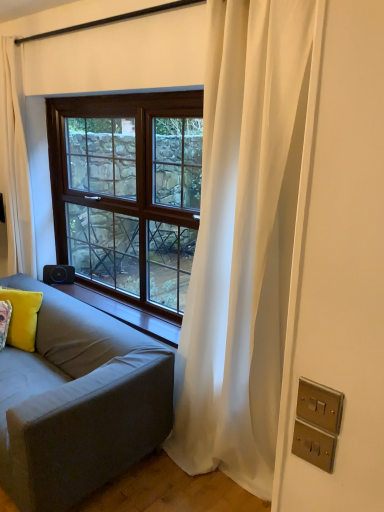
Question: Is white sheer curtain at right, the 2th curtain when ordered from left to right, wider than black plastic speaker at lower left?

Choices:
 (A) no
 (B) yes

Answer: (B)

Question: From the image's perspective, is white sheer curtain at right, the 2th curtain when ordered from left to right, below black plastic speaker at lower left?

Choices:
 (A) yes
 (B) no

Answer: (B)

Question: Can you confirm if white sheer curtain at right, the 2th curtain when ordered from left to right, is shorter than black plastic speaker at lower left?

Choices:
 (A) no
 (B) yes

Answer: (A)

Question: From a real-world perspective, does white sheer curtain at right, positioned as the 1th curtain in front-to-back order, stand above black plastic speaker at lower left?

Choices:
 (A) yes
 (B) no

Answer: (A)

Question: Can you confirm if white sheer curtain at right, which is the 1th curtain from right to left, is positioned to the left of black plastic speaker at lower left?

Choices:
 (A) no
 (B) yes

Answer: (A)

Question: From the image's perspective, is black plastic speaker at lower left positioned above or below white sheer curtain at right, the 2th curtain when ordered from left to right?

Choices:
 (A) above
 (B) below

Answer: (B)

Question: Choose the correct answer: Is black plastic speaker at lower left inside white sheer curtain at right, which appears as the 2th curtain when viewed from the back, or outside it?

Choices:
 (A) inside
 (B) outside

Answer: (B)

Question: In the image, is black plastic speaker at lower left positioned in front of or behind white sheer curtain at right, which appears as the 2th curtain when viewed from the back?

Choices:
 (A) behind
 (B) front

Answer: (A)

Question: Considering the positions of point (59, 281) and point (294, 304), is point (59, 281) closer or farther from the camera than point (294, 304)?

Choices:
 (A) farther
 (B) closer

Answer: (A)

Question: Is yellow velvet pillow at lower left bigger or smaller than satin gold switchplate at lower right, which ranks as the 2th electric outlet in top-to-bottom order?

Choices:
 (A) small
 (B) big

Answer: (B)

Question: Considering the positions of yellow velvet pillow at lower left and satin gold switchplate at lower right, which ranks as the 2th electric outlet in top-to-bottom order, in the image, is yellow velvet pillow at lower left wider or thinner than satin gold switchplate at lower right, which ranks as the 2th electric outlet in top-to-bottom order,?

Choices:
 (A) thin
 (B) wide

Answer: (B)

Question: From the image's perspective, is yellow velvet pillow at lower left located above or below satin gold switchplate at lower right, which ranks as the 2th electric outlet in top-to-bottom order?

Choices:
 (A) above
 (B) below

Answer: (B)

Question: From a real-world perspective, is yellow velvet pillow at lower left positioned above or below satin gold switchplate at lower right, which is the 1th electric outlet from bottom to top?

Choices:
 (A) above
 (B) below

Answer: (B)

Question: Is yellow velvet pillow at lower left to the left or to the right of gray fabric couch at left in the image?

Choices:
 (A) right
 (B) left

Answer: (B)

Question: From a real-world perspective, is yellow velvet pillow at lower left above or below gray fabric couch at left?

Choices:
 (A) below
 (B) above

Answer: (B)